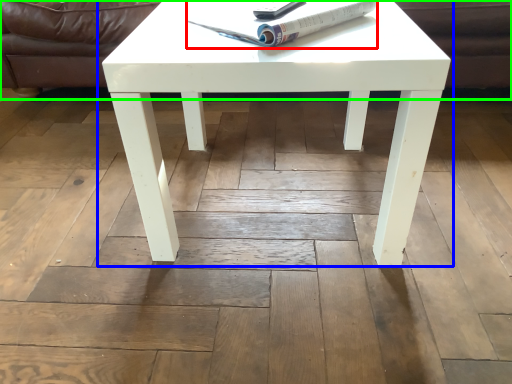
Question: Based on their relative distances, which object is farther from magazine (highlighted by a red box)? Choose from coffee table (highlighted by a blue box) and couch (highlighted by a green box).

Choices:
 (A) coffee table
 (B) couch

Answer: (B)